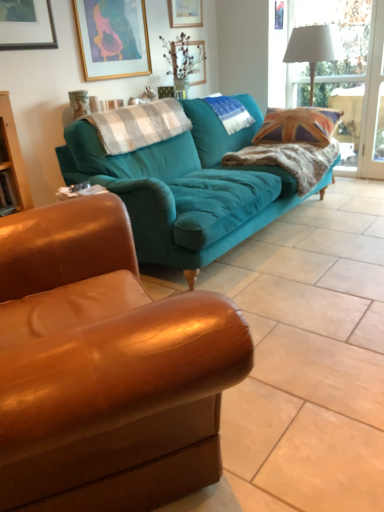
Question: Does teal fabric pillow at center, the 1th pillow when ordered from back to front, lie behind clear glass window at upper right?

Choices:
 (A) yes
 (B) no

Answer: (B)

Question: Is there a large distance between teal fabric pillow at center, acting as the 2th pillow starting from the front, and clear glass window at upper right?

Choices:
 (A) yes
 (B) no

Answer: (A)

Question: Can you confirm if teal fabric pillow at center, acting as the 2th pillow starting from the front, is thinner than clear glass window at upper right?

Choices:
 (A) no
 (B) yes

Answer: (A)

Question: Is teal fabric pillow at center, the 1th pillow when ordered from back to front, positioned beyond the bounds of clear glass window at upper right?

Choices:
 (A) yes
 (B) no

Answer: (A)

Question: Can you confirm if teal fabric pillow at center, the first pillow when ordered from right to left, is positioned to the left of clear glass window at upper right?

Choices:
 (A) no
 (B) yes

Answer: (B)

Question: From a real-world perspective, is clear glass window at upper right above or below wooden picture frame at upper center, the 1th picture frame in the right-to-left sequence?

Choices:
 (A) above
 (B) below

Answer: (B)

Question: Is clear glass window at upper right in front of or behind wooden picture frame at upper center, placed as the second picture frame when sorted from left to right, in the image?

Choices:
 (A) front
 (B) behind

Answer: (B)

Question: Would you say clear glass window at upper right is to the left or to the right of wooden picture frame at upper center, marked as the 2th picture frame in a bottom-to-top arrangement, in the picture?

Choices:
 (A) right
 (B) left

Answer: (A)

Question: Is clear glass window at upper right taller or shorter than wooden picture frame at upper center, the 1th picture frame in the right-to-left sequence?

Choices:
 (A) tall
 (B) short

Answer: (A)

Question: Is wooden picture frame at upper center, marked as the 2th picture frame in a bottom-to-top arrangement, wider or thinner than teal fabric couch at center, the first studio couch when ordered from front to back?

Choices:
 (A) wide
 (B) thin

Answer: (B)

Question: Is point (187, 5) closer or farther from the camera than point (43, 399)?

Choices:
 (A) closer
 (B) farther

Answer: (B)

Question: Considering the positions of wooden picture frame at upper center, the 1th picture frame in the right-to-left sequence, and teal fabric couch at center, the first studio couch when ordered from front to back, in the image, is wooden picture frame at upper center, the 1th picture frame in the right-to-left sequence, bigger or smaller than teal fabric couch at center, the first studio couch when ordered from front to back,?

Choices:
 (A) small
 (B) big

Answer: (A)

Question: Choose the correct answer: Is wooden picture frame at upper center, marked as the 2th picture frame in a bottom-to-top arrangement, inside teal fabric couch at center, the first studio couch when ordered from front to back, or outside it?

Choices:
 (A) inside
 (B) outside

Answer: (B)

Question: Is clear glass window at upper right in front of or behind union jack fabric pillow at right in the image?

Choices:
 (A) behind
 (B) front

Answer: (A)

Question: Visually, is clear glass window at upper right positioned to the left or to the right of union jack fabric pillow at right?

Choices:
 (A) left
 (B) right

Answer: (B)